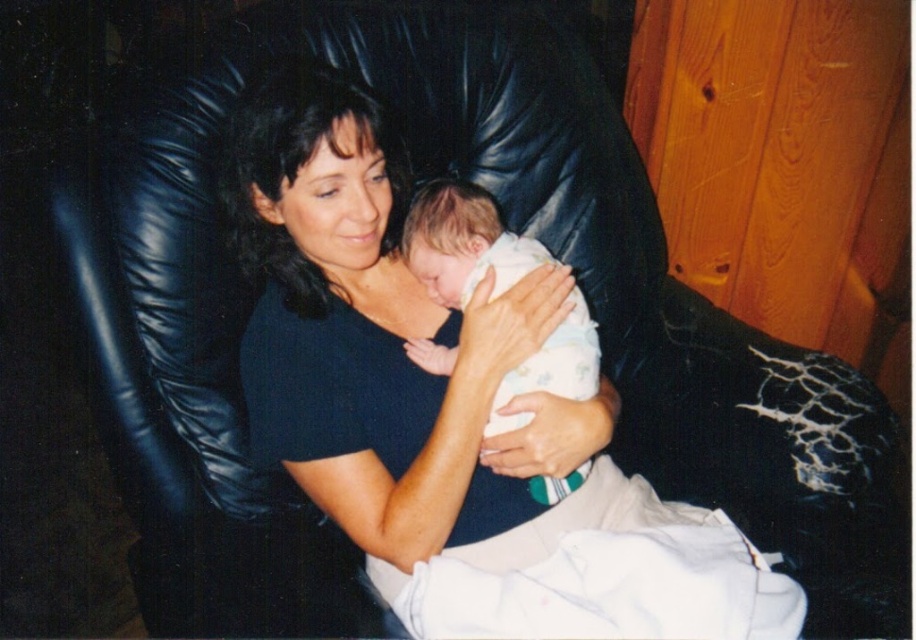
Between point (533, 282) and point (474, 282), which one is positioned behind?

The point (474, 282) is behind.

Who is more forward, (275, 452) or (482, 260)?

Point (275, 452) is in front.

You are a GUI agent. You are given a task and a screenshot of the screen. Output one action in this format:
    pyautogui.click(x=<x>, y=<y>)
    Task: Click on the black matte shirt at center
    The height and width of the screenshot is (640, 916).
    Given the screenshot: What is the action you would take?
    pyautogui.click(x=451, y=412)